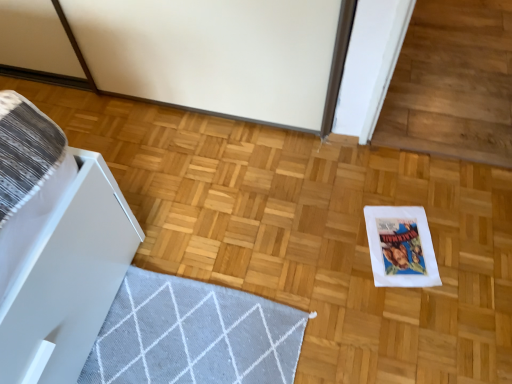
At what (x,y) coordinates should I click in order to perform the action: click on vacant area in front of matte white comic book at lower right. Please return your answer as a coordinate pair (x, y). Looking at the image, I should click on [x=415, y=315].